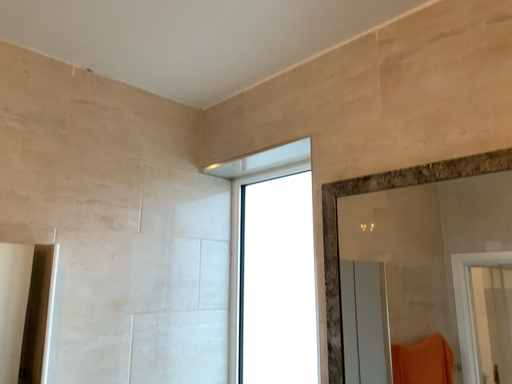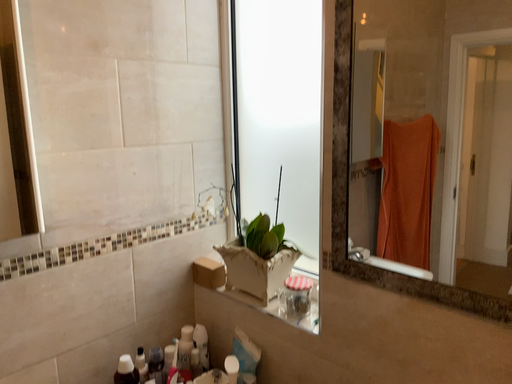
Question: How did the camera likely rotate when shooting the video?

Choices:
 (A) rotated downward
 (B) rotated upward

Answer: (A)